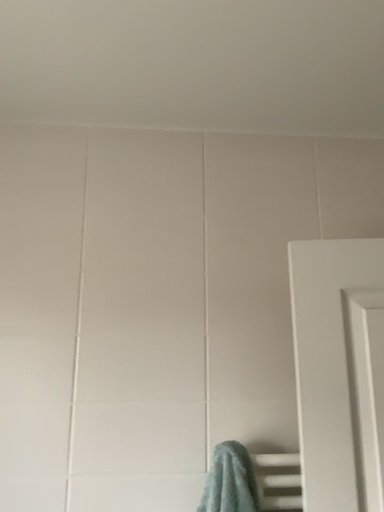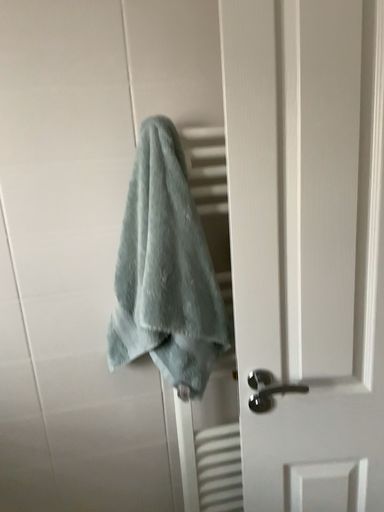
Question: Which way did the camera rotate in the video?

Choices:
 (A) rotated left
 (B) rotated right

Answer: (B)